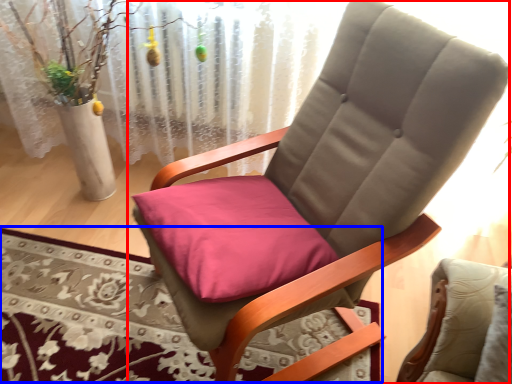
Question: Which object appears farthest to the camera in this image, chair (highlighted by a red box) or mat (highlighted by a blue box)?

Choices:
 (A) chair
 (B) mat

Answer: (B)